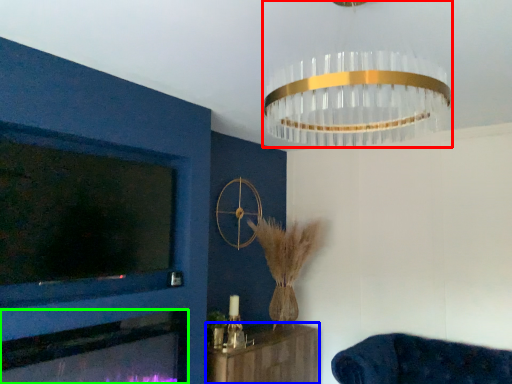
Question: Which object is the closest to the lamp (highlighted by a red box)? Choose among these: furniture (highlighted by a blue box) or fireplace (highlighted by a green box).

Choices:
 (A) furniture
 (B) fireplace

Answer: (B)